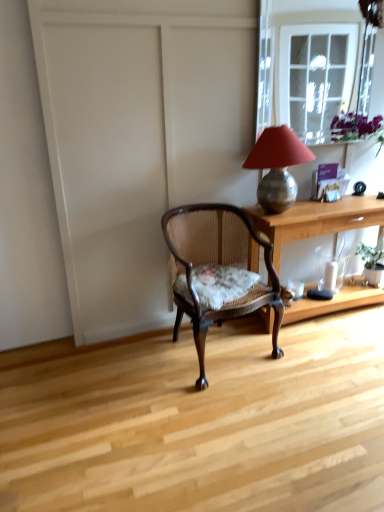
Where is `free location to the left of wooden cane chair with floral cushion at center`? This screenshot has height=512, width=384. free location to the left of wooden cane chair with floral cushion at center is located at coordinates (123, 369).